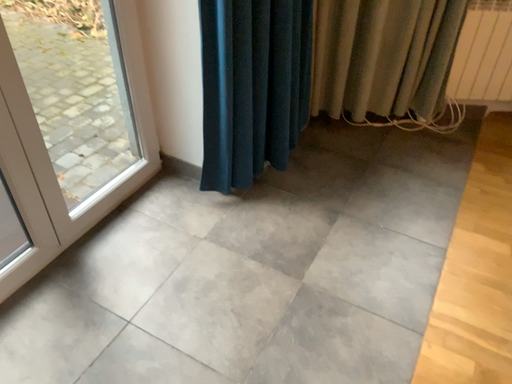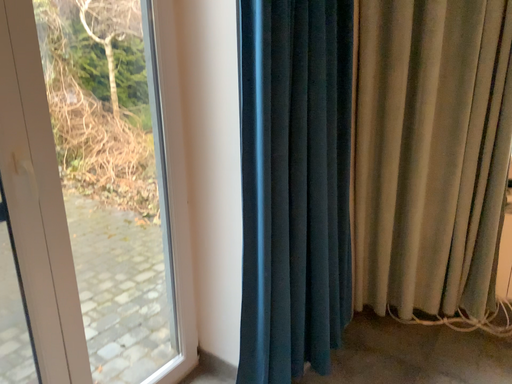
Question: Which way did the camera rotate in the video?

Choices:
 (A) rotated left
 (B) rotated right

Answer: (A)